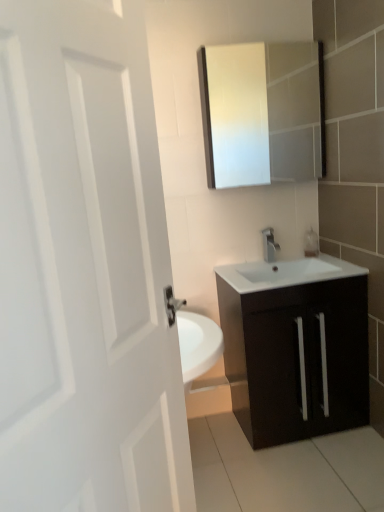
This screenshot has height=512, width=384. In order to click on free space in front of silver metallic tap at center in this screenshot , I will do `click(277, 270)`.